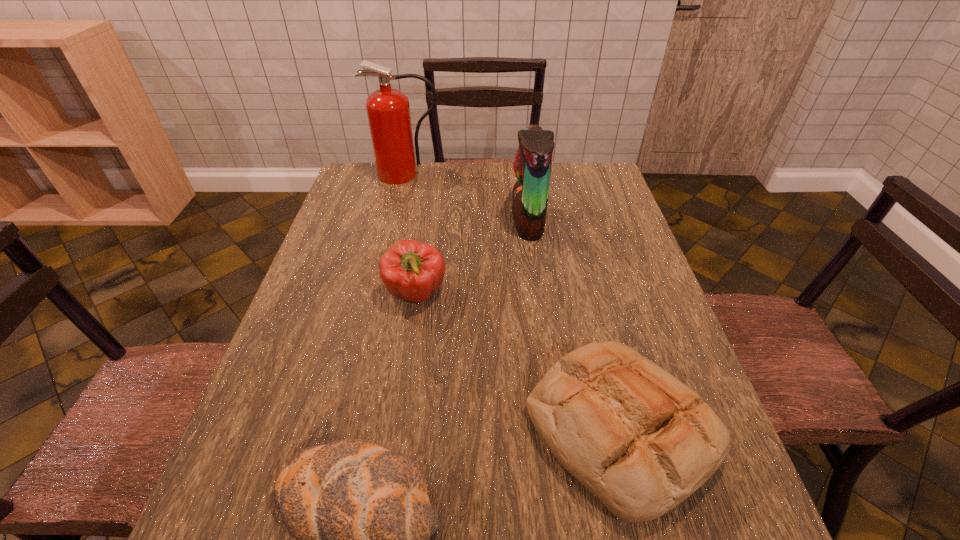
Identify the location of the farthest object. This screenshot has height=540, width=960. [388, 110].

The image size is (960, 540). I want to click on fire extinguisher, so click(x=388, y=110).

Locate an element on the screen. Image resolution: width=960 pixels, height=540 pixels. the fourth nearest object is located at coordinates (532, 165).

Locate an element on the screen. Image resolution: width=960 pixels, height=540 pixels. the fourth shortest object is located at coordinates (532, 165).

Where is `bell pepper`? The height and width of the screenshot is (540, 960). bell pepper is located at coordinates (411, 270).

What are the coordinates of `the taller bread` in the screenshot? It's located at (640, 440).

Identify the location of vacant point located with the handle and nozzle on the tallest object. The image size is (960, 540). (396, 216).

Find the location of a particular element. The image size is (960, 540). free space located 0.200m at the face of the second tallest object is located at coordinates (445, 221).

Identify the location of vacant area situated at the face of the second tallest object. The image size is (960, 540). (402, 221).

Where is `vacant space situated 0.220m at the face of the second tallest object`? Image resolution: width=960 pixels, height=540 pixels. vacant space situated 0.220m at the face of the second tallest object is located at coordinates (439, 221).